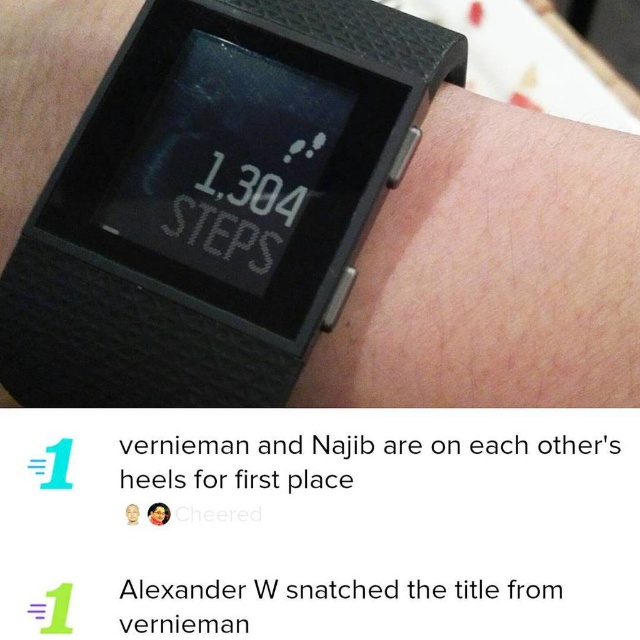
Question: Which object appears closest to the camera in this image?

Choices:
 (A) black matte watch at upper center
 (B) matte black watch at upper center

Answer: (B)

Question: Does black matte watch at upper center have a lesser width compared to matte black watch at upper center?

Choices:
 (A) no
 (B) yes

Answer: (A)

Question: Which of the following is the farthest from the observer?

Choices:
 (A) (557, 301)
 (B) (177, 324)

Answer: (B)

Question: Can you confirm if black matte watch at upper center is positioned to the left of matte black watch at upper center?

Choices:
 (A) no
 (B) yes

Answer: (B)

Question: Among these points, which one is farthest from the camera?

Choices:
 (A) (125, 349)
 (B) (403, 244)

Answer: (B)

Question: Can you confirm if black matte watch at upper center is bigger than matte black watch at upper center?

Choices:
 (A) yes
 (B) no

Answer: (A)